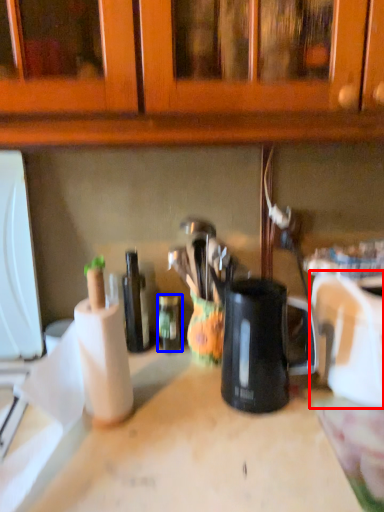
Question: Which point is closer to the camera, appliance (highlighted by a red box) or bottle (highlighted by a blue box)?

Choices:
 (A) appliance
 (B) bottle

Answer: (A)